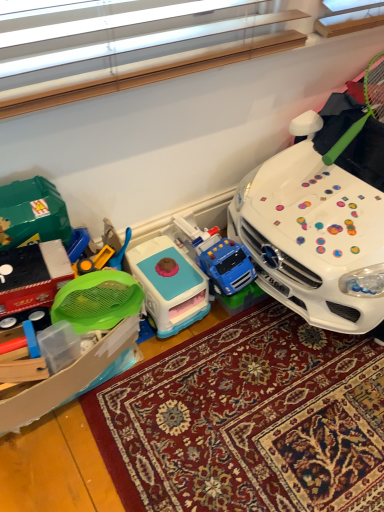
Where is `free space above carpeted rug at center (from a real-world perspective)`? The image size is (384, 512). free space above carpeted rug at center (from a real-world perspective) is located at coordinates (228, 396).